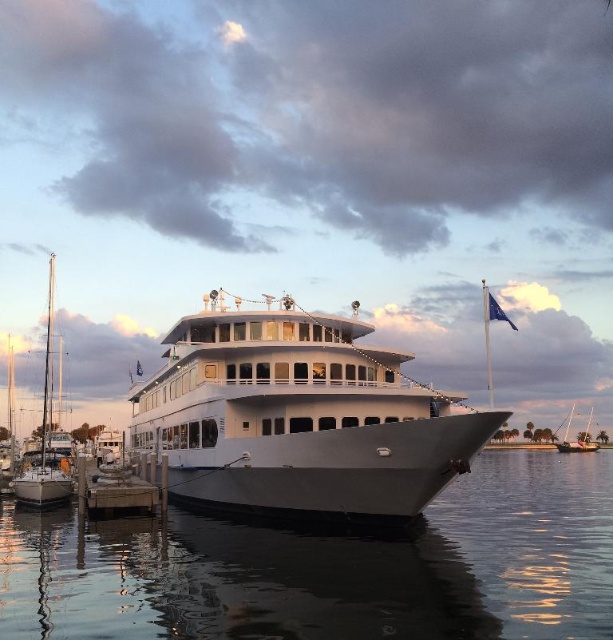
You are standing on the dock looking at the yacht. There are two points marked on the yacht. One is at coordinate point (482, 420) and the other is at point (50, 305). Which point is closer to you?

Point (482, 420) is closer to the viewer than point (50, 305).

You are standing on the dock next to the yacht and want to reach the point marked at coordinates point (287,433). If your walking speed is 1.5 meters per second, how many seconds will it take you to reach that point?

The distance between you and point (287,433) is 43.26 meters. At a speed of 1.5 meters per second, it would take 28.84 seconds to reach the point.

You are standing on the dock and see the white glossy yacht at center and the white glossy sailboat at lower right. Which vessel is positioned to the left when viewed from your perspective?

The white glossy yacht at center is positioned to the left of the white glossy sailboat at lower right.